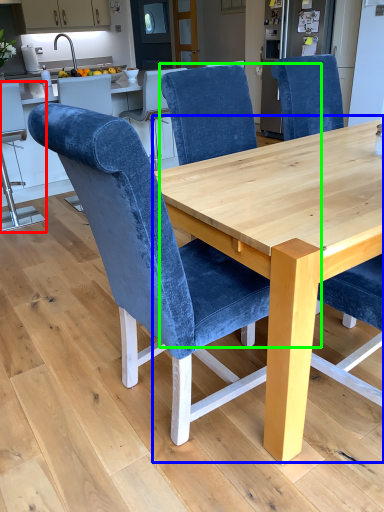
Question: Based on their relative distances, which object is nearer to chair (highlighted by a red box)? Choose from round table (highlighted by a blue box) and chair (highlighted by a green box).

Choices:
 (A) round table
 (B) chair

Answer: (B)